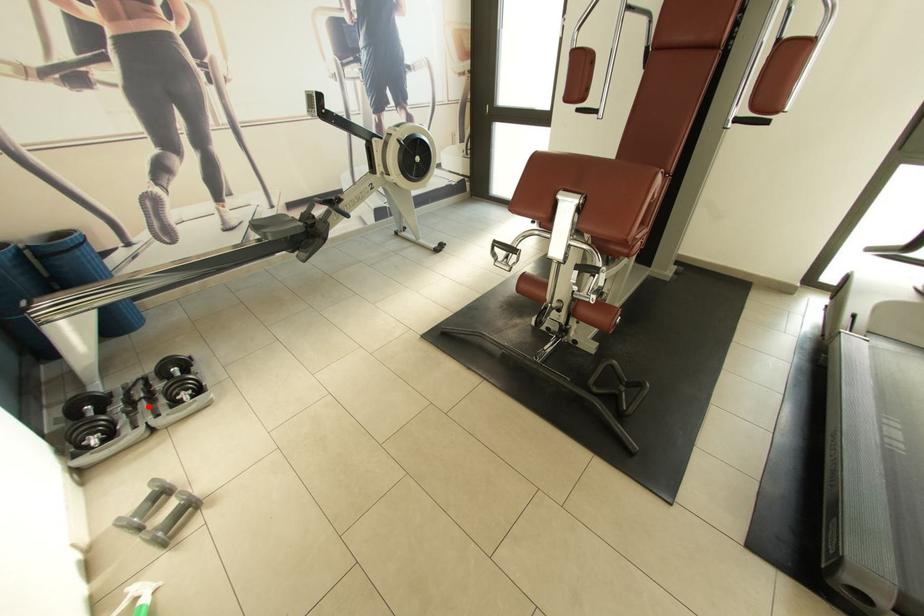
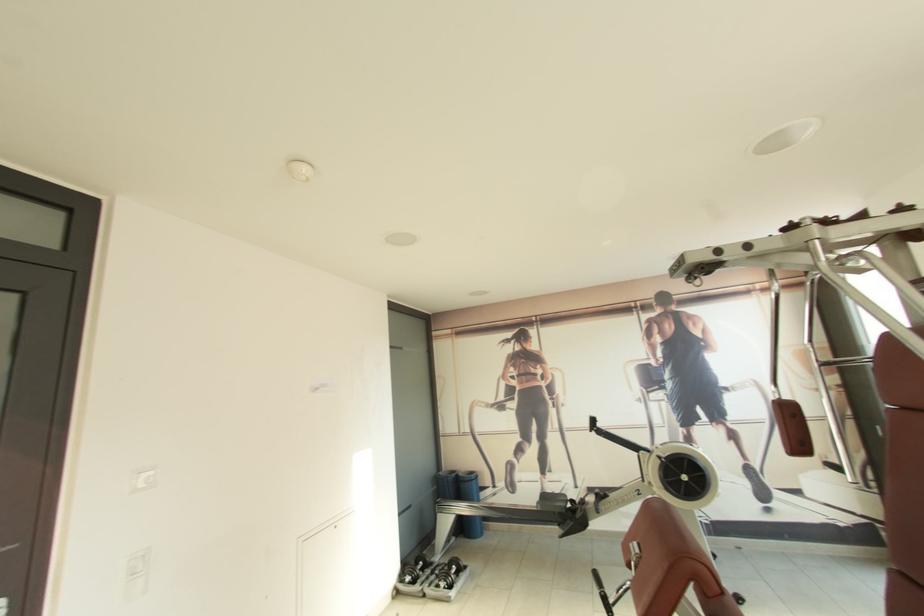
Question: A red point is marked in image1. In image2, is the corresponding 3D point closer to the camera or farther? Reply with the corresponding letter.

Choices:
 (A) The corresponding 3D point is closer.
 (B) The corresponding 3D point is farther.

Answer: (B)